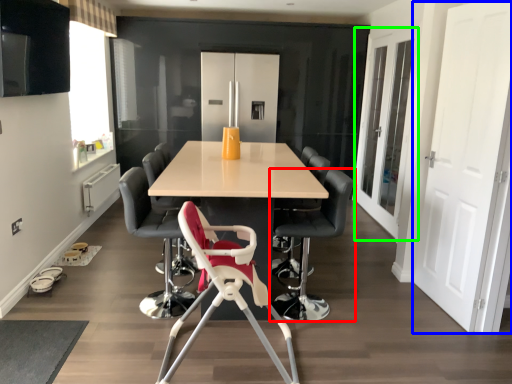
Question: Which object is positioned closest to chair (highlighted by a red box)? Select from door (highlighted by a blue box) and glass door (highlighted by a green box).

Choices:
 (A) door
 (B) glass door

Answer: (A)